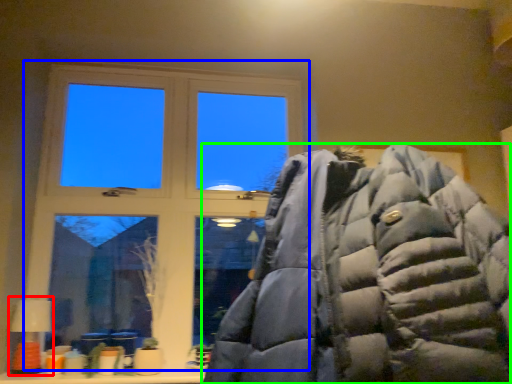
Question: Considering the real-world distances, which object is closest to table lamp (highlighted by a red box)? window (highlighted by a blue box) or jacket (highlighted by a green box).

Choices:
 (A) window
 (B) jacket

Answer: (A)